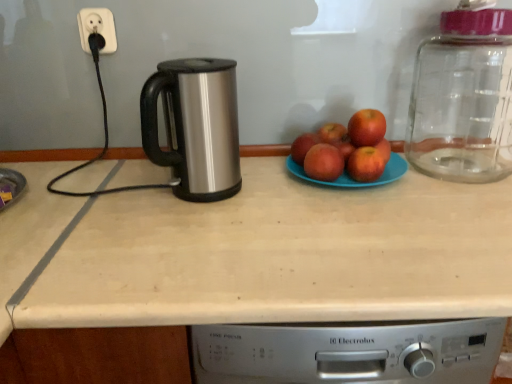
Question: Does point (419, 206) appear closer or farther from the camera than point (305, 145)?

Choices:
 (A) farther
 (B) closer

Answer: (B)

Question: In the image, is beige laminate countertop at center positioned in front of or behind red matte apple at center, the 2th apple in the back-to-front sequence?

Choices:
 (A) front
 (B) behind

Answer: (A)

Question: Which object is positioned farthest from the white plastic socket at upper left?

Choices:
 (A) polished stainless steel kettle at center
 (B) red matte apple at center, placed as the 3th apple when sorted from back to front
 (C) blue matte plate at center
 (D) beige laminate countertop at center
 (E) red matte apple at center, placed as the 2th apple when sorted from front to back

Answer: (E)

Question: Which object is the closest to the beige laminate countertop at center?

Choices:
 (A) red matte apple at center, placed as the 3th apple when sorted from back to front
 (B) red matte apple at center, which is counted as the 1th apple, starting from the front
 (C) red matte apple at center, placed as the fourth apple when sorted from front to back
 (D) red matte apple at center, the 4th apple from the back
 (E) blue matte plate at center

Answer: (E)